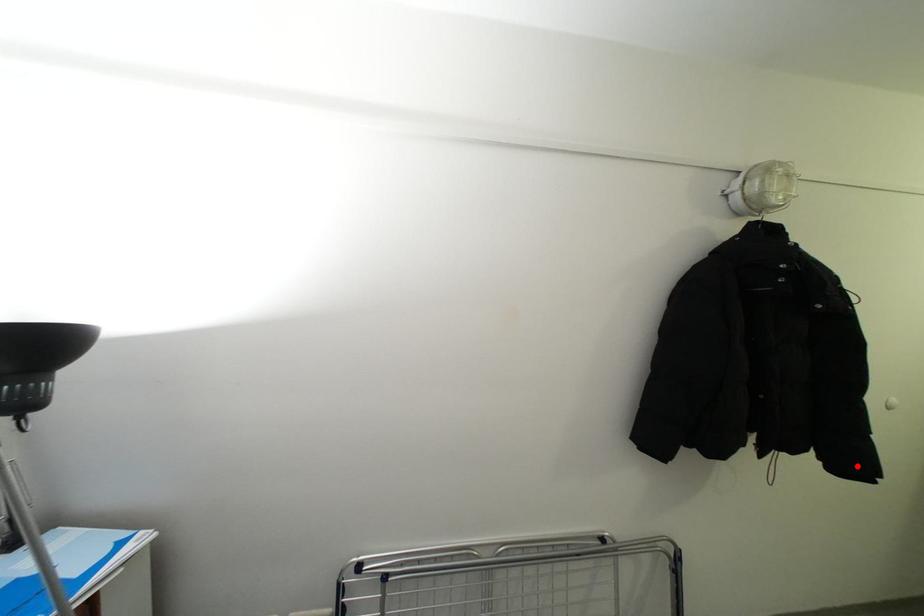
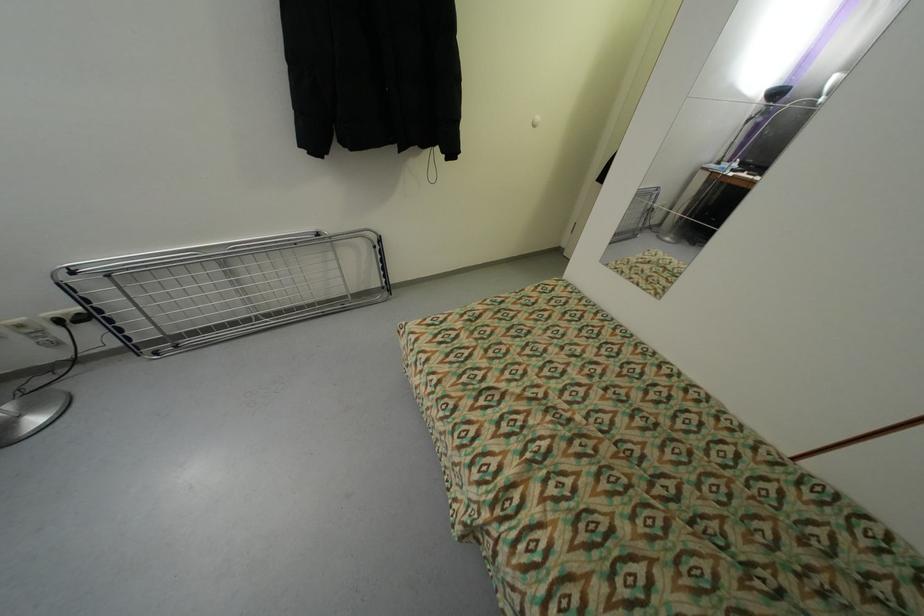
Question: I am providing you with two images of the same scene from different viewpoints. A red point is shown in image1. For the corresponding object point in image2, is it positioned nearer or farther from the camera?

Choices:
 (A) Nearer
 (B) Farther

Answer: (B)